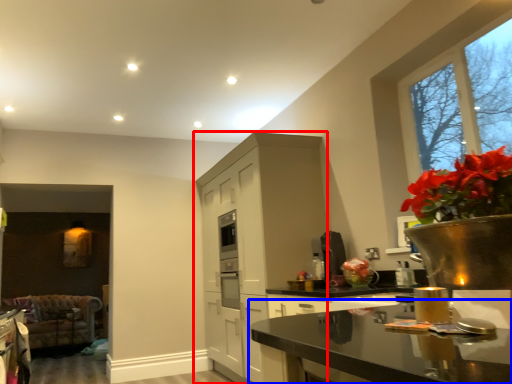
Question: Which object is closer to the camera taking this photo, cabinetry (highlighted by a red box) or countertop (highlighted by a blue box)?

Choices:
 (A) cabinetry
 (B) countertop

Answer: (B)